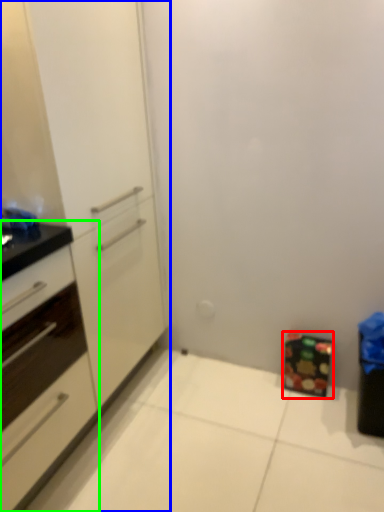
Question: Which object is the farthest from cabinetry (highlighted by a red box)? Choose among these: cabinetry (highlighted by a blue box) or cabinetry (highlighted by a green box).

Choices:
 (A) cabinetry
 (B) cabinetry

Answer: (B)